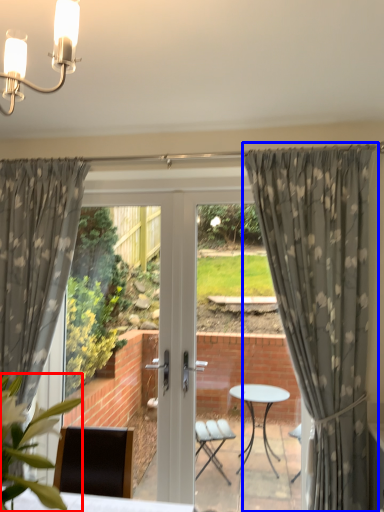
Question: Which object appears closest to the camera in this image, plant (highlighted by a red box) or curtain (highlighted by a blue box)?

Choices:
 (A) plant
 (B) curtain

Answer: (A)